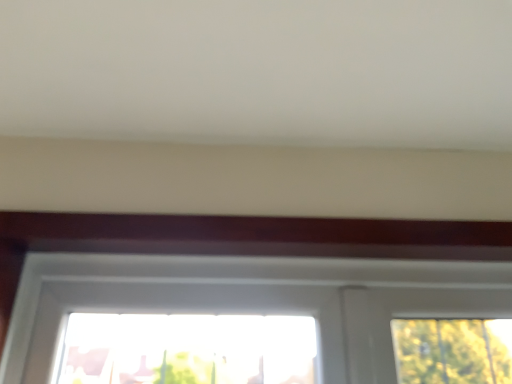
The width and height of the screenshot is (512, 384). Describe the element at coordinates (248, 299) in the screenshot. I see `white plastic window at center` at that location.

What is the approximate width of white plastic window at center?

The width of white plastic window at center is 1.76 inches.

Locate an element on the screen. The width and height of the screenshot is (512, 384). white plastic window at center is located at coordinates (248, 299).

Find the location of a particular element. This screenshot has width=512, height=384. white plastic window at center is located at coordinates (248, 299).